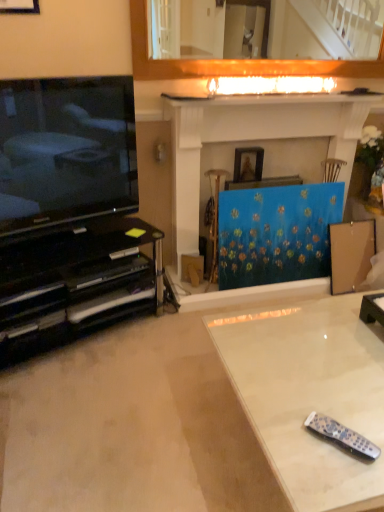
Locate an element on the screen. The image size is (384, 512). brown cardboard box at center is located at coordinates (192, 269).

The height and width of the screenshot is (512, 384). I want to click on blue canvas painting at center, so click(x=251, y=140).

Describe the element at coordinates (251, 140) in the screenshot. The width and height of the screenshot is (384, 512). I see `blue canvas painting at center` at that location.

Measure the distance between black glass tv stand at lower left and camera.

1.83 meters.

The image size is (384, 512). Identify the location of blue textured fabric at center. (276, 233).

Locate an element on the screen. Image resolution: width=384 pixels, height=512 pixels. white glossy mantle at upper center is located at coordinates (278, 95).

The width and height of the screenshot is (384, 512). What do you see at coordinates (278, 95) in the screenshot?
I see `white glossy mantle at upper center` at bounding box center [278, 95].

The height and width of the screenshot is (512, 384). I want to click on wooden mirror at upper center, so click(x=329, y=29).

From the image's perspective, between white glossy table at lower right and wooden mirror at upper center, which one is located above?

From the image's view, wooden mirror at upper center is above.

Is white glossy table at lower right in front of or behind wooden mirror at upper center in the image?

Visually, white glossy table at lower right is located in front of wooden mirror at upper center.

Consider the image. Is wooden mirror at upper center at the back of white glossy table at lower right?

white glossy table at lower right is not turned away from wooden mirror at upper center.

Can you tell me how much wooden picture frame at center, arranged as the second picture frame when viewed from the front, and black plastic remote at lower right differ in facing direction?

32.7 degrees separate the facing orientations of wooden picture frame at center, arranged as the second picture frame when viewed from the front, and black plastic remote at lower right.

From a real-world perspective, is wooden picture frame at center, arranged as the 1th picture frame when ordered from the bottom, below black plastic remote at lower right?

Actually, wooden picture frame at center, arranged as the 1th picture frame when ordered from the bottom, is physically above black plastic remote at lower right in the real world.

Which is more to the right, wooden picture frame at center, the 1th picture frame from the right, or black plastic remote at lower right?

Positioned to the right is black plastic remote at lower right.

Considering the relative sizes of white glossy table at lower right and black plastic remote at lower right in the image provided, is white glossy table at lower right bigger than black plastic remote at lower right?

Yes.

Does white glossy table at lower right have a lesser width compared to black plastic remote at lower right?

No, white glossy table at lower right is not thinner than black plastic remote at lower right.

Does point (355, 315) lie behind point (346, 435)?

Yes.

Does blue canvas painting at center turn towards wooden picture frame at center, acting as the 2th picture frame starting from the top?

Yes.

Does blue canvas painting at center appear on the right side of wooden picture frame at center, which is counted as the 1th picture frame, starting from the back?

Indeed, blue canvas painting at center is positioned on the right side of wooden picture frame at center, which is counted as the 1th picture frame, starting from the back.

Identify the location of fireplace below the wooden picture frame at center, arranged as the 1th picture frame when ordered from the bottom (from the image's perspective). Image resolution: width=384 pixels, height=512 pixels. (251, 140).

Looking at this image, is white glossy mantle at upper center smaller than matte black television at left?

Yes, white glossy mantle at upper center is smaller than matte black television at left.

Based on the photo, is white glossy mantle at upper center far away from matte black television at left?

Indeed, white glossy mantle at upper center is not near matte black television at left.

Is black plastic remote at lower right turned away from wooden picture frame at center, the 1th picture frame from the right?

No, wooden picture frame at center, the 1th picture frame from the right, is not at the back of black plastic remote at lower right.

Is black plastic remote at lower right inside or outside of wooden picture frame at center, the 1th picture frame from the right?

black plastic remote at lower right is located beyond the bounds of wooden picture frame at center, the 1th picture frame from the right.

Is the surface of black plastic remote at lower right in direct contact with wooden picture frame at center, which is the 2th picture frame in left-to-right order?

No, black plastic remote at lower right is not touching wooden picture frame at center, which is the 2th picture frame in left-to-right order.

Which object is positioned more to the right, blue canvas painting at center or white glossy mantle at upper center?

white glossy mantle at upper center is more to the right.

Is blue canvas painting at center further to the viewer compared to white glossy mantle at upper center?

No, it is in front of white glossy mantle at upper center.

Considering the sizes of blue canvas painting at center and white glossy mantle at upper center in the image, is blue canvas painting at center wider or thinner than white glossy mantle at upper center?

In the image, blue canvas painting at center appears to be wider than white glossy mantle at upper center.

Image resolution: width=384 pixels, height=512 pixels. In order to click on table in front of the wooden mirror at upper center in this screenshot , I will do `click(310, 395)`.

The image size is (384, 512). In order to click on picture frame that is the 1st object located above the black plastic remote at lower right (from the image's perspective) in this screenshot , I will do `click(255, 165)`.

From the image, which object appears to be nearer to wooden picture frame at upper left, the 2th picture frame from the bottom, matte black television at left or black plastic remote at lower right?

matte black television at left is closer to wooden picture frame at upper left, the 2th picture frame from the bottom.

When comparing their distances from blue textured fabric at center, does white glossy table at lower right or wooden mirror at upper center seem further?

wooden mirror at upper center is positioned further to the anchor blue textured fabric at center.

When comparing their distances from black glass tv stand at lower left, does white glossy table at lower right or wooden mirror at upper center seem further?

Among the two, wooden mirror at upper center is located further to black glass tv stand at lower left.

Based on their spatial positions, is black glass tv stand at lower left or wooden picture frame at center, the 1th picture frame from the right, further from blue canvas painting at center?

black glass tv stand at lower left.

Based on their spatial positions, is brown cardboard box at center or blue textured fabric at center closer to matte black television at left?

blue textured fabric at center is closer to matte black television at left.

Based on their spatial positions, is blue textured fabric at center or matte black television at left closer to brown cardboard box at center?

Among the two, blue textured fabric at center is located nearer to brown cardboard box at center.

Considering their positions, is blue textured fabric at center positioned further to matte black television at left than blue canvas painting at center?

blue textured fabric at center is further to matte black television at left.

Looking at this image, estimate the real-world distances between objects in this image. Which object is closer to blue canvas painting at center, black glass tv stand at lower left or blue textured fabric at center?

blue textured fabric at center is positioned closer to the anchor blue canvas painting at center.

Locate an element on the screen. Image resolution: width=384 pixels, height=512 pixels. desk between white glossy table at lower right and brown cardboard box at center in the front-back direction is located at coordinates (75, 283).

This screenshot has height=512, width=384. What are the coordinates of `television between wooden picture frame at upper left, the second picture frame in the right-to-left sequence, and white glossy table at lower right from top to bottom` in the screenshot? It's located at (66, 150).

I want to click on fireplace that lies between wooden mirror at upper center and blue textured fabric at center from top to bottom, so (x=251, y=140).

Find the location of a particular element. This screenshot has height=512, width=384. picture frame between wooden picture frame at upper left, the 1th picture frame when ordered from left to right, and blue textured fabric at center from left to right is located at coordinates (255, 165).